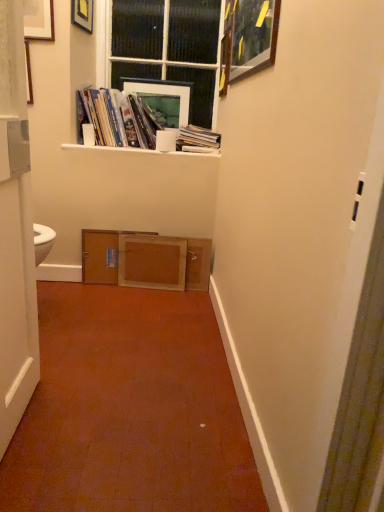
Question: Is point (142, 150) positioned closer to the camera than point (168, 129)?

Choices:
 (A) farther
 (B) closer

Answer: (B)

Question: From a real-world perspective, is white matte shelf at upper center above or below white matte toilet paper at upper center?

Choices:
 (A) above
 (B) below

Answer: (B)

Question: Considering the real-world distances, which object is farthest from the white matte toilet paper at upper center?

Choices:
 (A) matte black picture frame at upper left, positioned as the 3th picture frame in right-to-left order
 (B) matte white picture frame at upper center, which appears as the second picture frame when viewed from the right
 (C) matte paper books at upper center, the 1th book in the left-to-right sequence
 (D) wooden cabinet at center
 (E) white matte shelf at upper center

Answer: (A)

Question: Which object is the closest to the wooden cabinet at center?

Choices:
 (A) matte white picture frame at upper center, which appears as the second picture frame when viewed from the right
 (B) black glass window at upper center
 (C) wooden drawer at center
 (D) white matte shelf at upper center
 (E) matte paper books at upper center, the 1th book in the left-to-right sequence

Answer: (C)